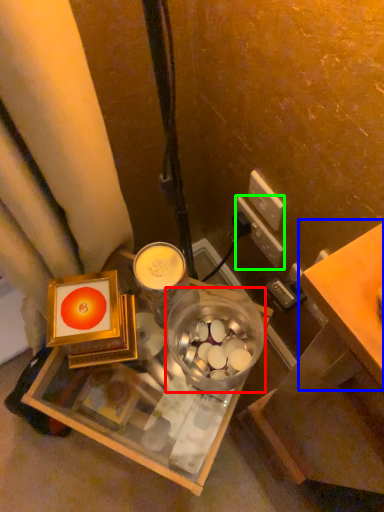
Question: Based on their relative distances, which object is nearer to glass bowl (highlighted by a red box)? Choose from table (highlighted by a blue box) and power outlet (highlighted by a green box).

Choices:
 (A) table
 (B) power outlet

Answer: (B)